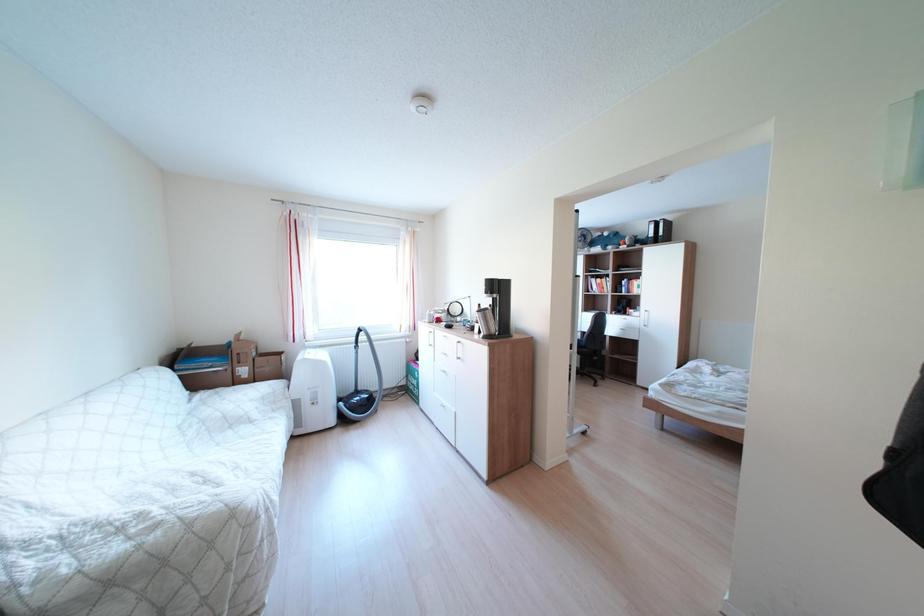
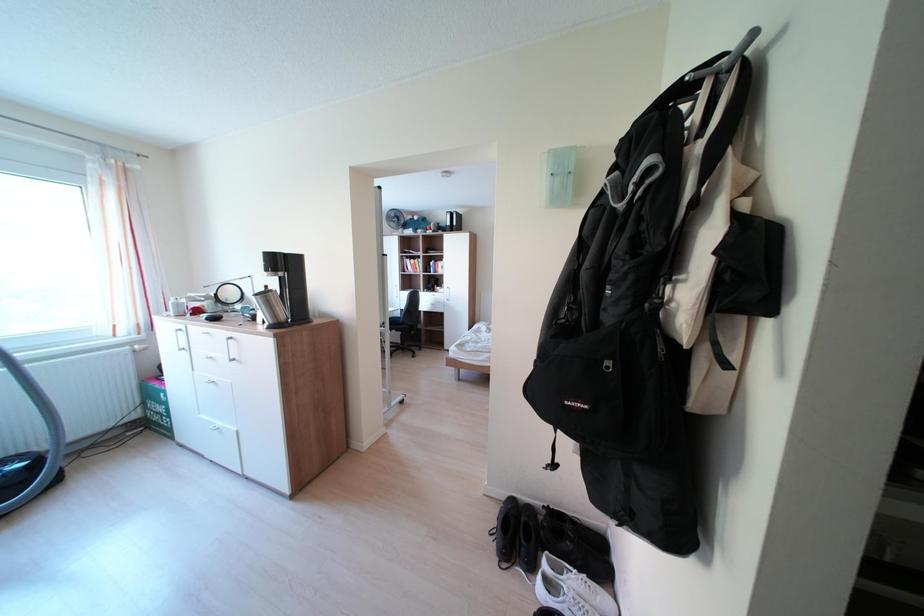
Question: The images are taken continuously from a first-person perspective. In which direction is your viewpoint rotating?

Choices:
 (A) Left
 (B) Right
 (C) Up
 (D) Down

Answer: (B)